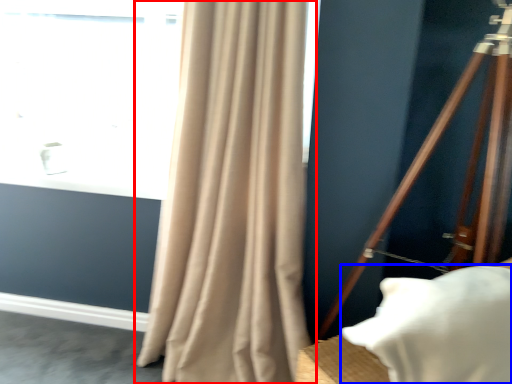
Question: Among these objects, which one is farthest to the camera, curtain (highlighted by a red box) or pillow (highlighted by a blue box)?

Choices:
 (A) curtain
 (B) pillow

Answer: (A)